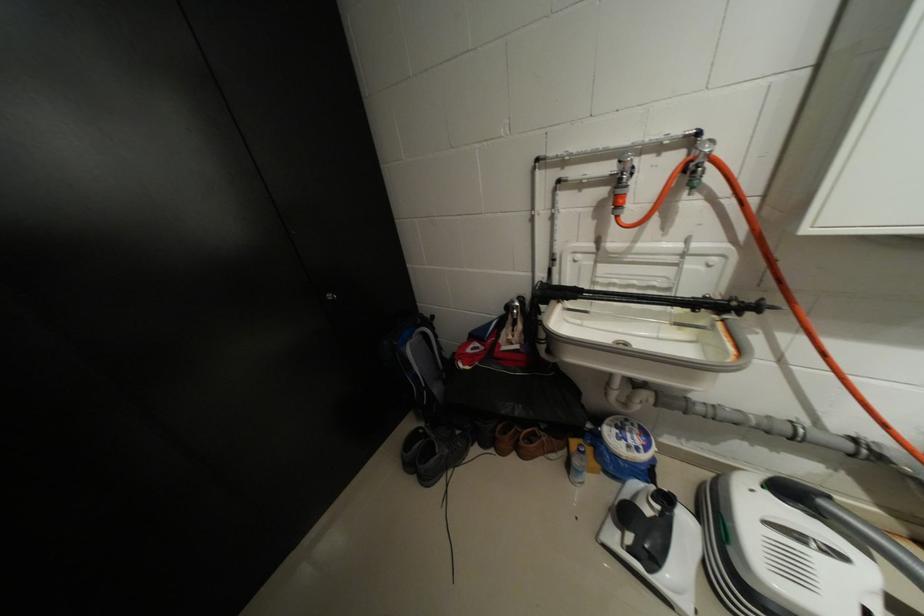
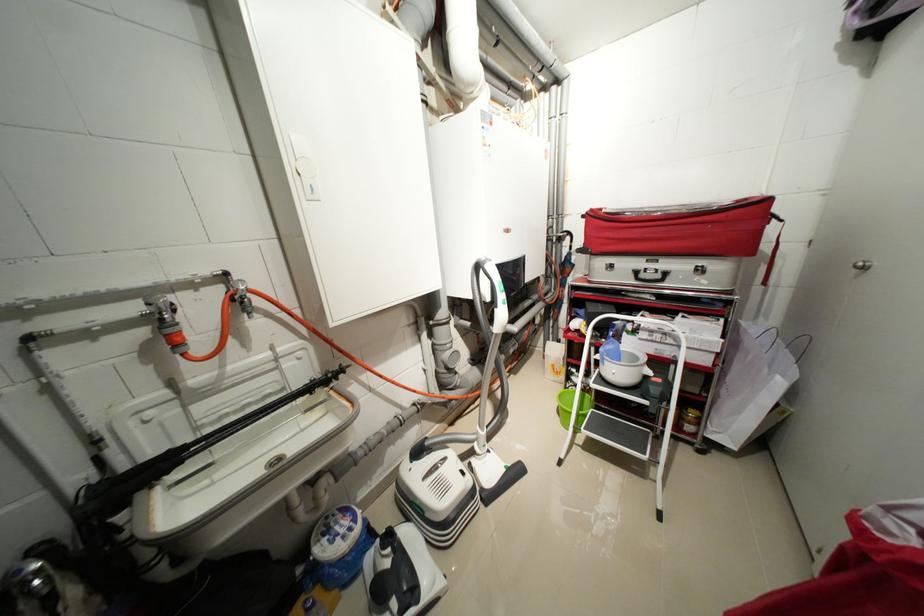
Locate, in the second image, the point that corresponds to the point at 626,163 in the first image.

(155, 305)